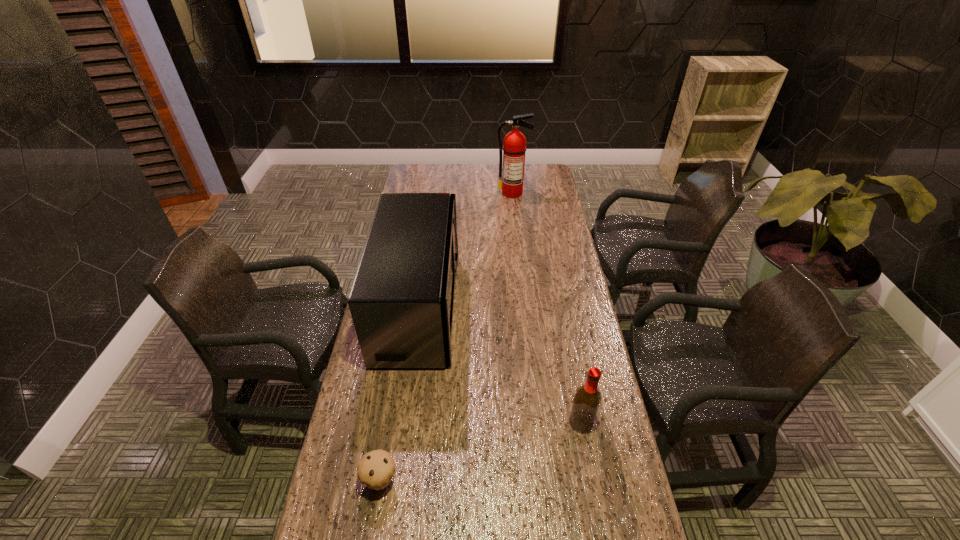
Identify the location of the second object from right to left. (511, 182).

What are the coordinates of `the tallest object` in the screenshot? It's located at (511, 182).

Find the location of a particular element. the second farthest object is located at coordinates (402, 299).

Identify the location of microwave_oven. The width and height of the screenshot is (960, 540). (402, 299).

Locate an element on the screen. Image resolution: width=960 pixels, height=540 pixels. beer bottle is located at coordinates (587, 399).

Locate an element on the screen. This screenshot has width=960, height=540. the rightmost object is located at coordinates (587, 399).

Locate an element on the screen. the shortest object is located at coordinates (376, 469).

This screenshot has height=540, width=960. What are the coordinates of `muffin` in the screenshot? It's located at (376, 469).

Where is `vacant region located on the side of the fire extinguisher near the handle`? This screenshot has width=960, height=540. vacant region located on the side of the fire extinguisher near the handle is located at coordinates (515, 213).

At what (x,y) coordinates should I click in order to perform the action: click on vacant space located on the front-facing side of the second tallest object. Please return your answer as a coordinate pair (x, y). Looking at the image, I should click on (517, 307).